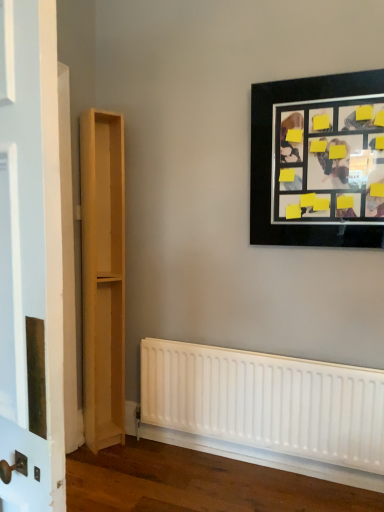
Question: From the image's perspective, would you say black matte picture frame at upper right is positioned over light wood bookshelf at left?

Choices:
 (A) yes
 (B) no

Answer: (A)

Question: Can you confirm if black matte picture frame at upper right is thinner than light wood bookshelf at left?

Choices:
 (A) no
 (B) yes

Answer: (B)

Question: Is black matte picture frame at upper right turned away from light wood bookshelf at left?

Choices:
 (A) yes
 (B) no

Answer: (B)

Question: Considering the relative positions of black matte picture frame at upper right and light wood bookshelf at left in the image provided, is black matte picture frame at upper right to the left of light wood bookshelf at left from the viewer's perspective?

Choices:
 (A) yes
 (B) no

Answer: (B)

Question: Can we say black matte picture frame at upper right lies outside light wood bookshelf at left?

Choices:
 (A) yes
 (B) no

Answer: (A)

Question: From a real-world perspective, relative to light wood bookshelf at left, is white matte radiator at lower center vertically above or below?

Choices:
 (A) above
 (B) below

Answer: (B)

Question: Is white matte radiator at lower center spatially inside light wood bookshelf at left, or outside of it?

Choices:
 (A) outside
 (B) inside

Answer: (A)

Question: Considering the relative positions of white matte radiator at lower center and light wood bookshelf at left in the image provided, is white matte radiator at lower center to the left or to the right of light wood bookshelf at left?

Choices:
 (A) left
 (B) right

Answer: (B)

Question: Is white matte radiator at lower center in front of or behind light wood bookshelf at left in the image?

Choices:
 (A) front
 (B) behind

Answer: (A)

Question: Would you say white matte radiator at lower center is inside or outside black matte picture frame at upper right?

Choices:
 (A) outside
 (B) inside

Answer: (A)

Question: Visually, is white matte radiator at lower center positioned to the left or to the right of black matte picture frame at upper right?

Choices:
 (A) right
 (B) left

Answer: (B)

Question: In terms of size, does white matte radiator at lower center appear bigger or smaller than black matte picture frame at upper right?

Choices:
 (A) small
 (B) big

Answer: (A)

Question: Is white matte radiator at lower center taller or shorter than black matte picture frame at upper right?

Choices:
 (A) short
 (B) tall

Answer: (A)

Question: Considering their positions, is black matte picture frame at upper right located in front of or behind light wood bookshelf at left?

Choices:
 (A) behind
 (B) front

Answer: (B)

Question: From the image's perspective, relative to light wood bookshelf at left, is black matte picture frame at upper right above or below?

Choices:
 (A) below
 (B) above

Answer: (B)